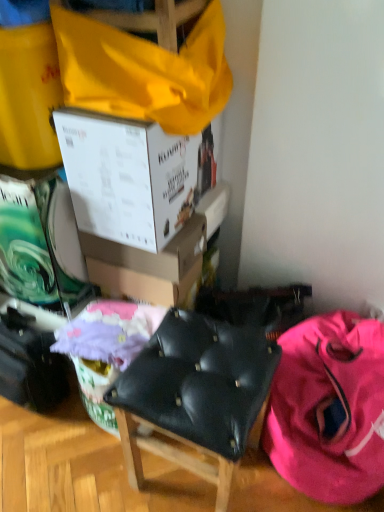
Measure the distance between white cardboard box at upper center, the 1th box positioned from the bottom, and camera.

white cardboard box at upper center, the 1th box positioned from the bottom, and camera are 1.20 meters apart from each other.

Locate an element on the screen. black leather chair at center is located at coordinates (196, 395).

The width and height of the screenshot is (384, 512). I want to click on pastel pink fabric at center, so click(x=109, y=332).

Image resolution: width=384 pixels, height=512 pixels. What are the coordinates of `white cardboard box at upper center, which ranks as the second box in bottom-to-top order` in the screenshot? It's located at (133, 177).

Consider the image. Between pastel pink fabric at center and pink fabric backpack at lower right, which one appears on the left side from the viewer's perspective?

pastel pink fabric at center is more to the left.

Is pastel pink fabric at center far away from pink fabric backpack at lower right?

No, pastel pink fabric at center is not far from pink fabric backpack at lower right.

Measure the distance from pastel pink fabric at center to pink fabric backpack at lower right.

pastel pink fabric at center is 21.01 inches from pink fabric backpack at lower right.

From a real-world perspective, which object rests below the other?

pink fabric backpack at lower right is physically lower.

Which of these two, white cardboard box at upper center, positioned as the 1th box in top-to-bottom order, or black leather chair at center, is wider?

Wider between the two is black leather chair at center.

Is white cardboard box at upper center, positioned as the 1th box in top-to-bottom order, touching black leather chair at center?

No, white cardboard box at upper center, positioned as the 1th box in top-to-bottom order, is not in contact with black leather chair at center.

Is white cardboard box at upper center, which ranks as the second box in bottom-to-top order, turned away from black leather chair at center?

No, white cardboard box at upper center, which ranks as the second box in bottom-to-top order,'s orientation is not away from black leather chair at center.

Who is taller, white cardboard box at upper center, positioned as the 1th box in top-to-bottom order, or black leather chair at center?

Standing taller between the two is black leather chair at center.

Are pastel pink fabric at center and white cardboard box at upper center, arranged as the second box when viewed from the top, beside each other?

No, pastel pink fabric at center is not touching white cardboard box at upper center, arranged as the second box when viewed from the top.

Is pastel pink fabric at center looking in the opposite direction of white cardboard box at upper center, the 1th box positioned from the bottom?

That's not correct — pastel pink fabric at center is not looking away from white cardboard box at upper center, the 1th box positioned from the bottom.

Can you confirm if pastel pink fabric at center is positioned to the right of white cardboard box at upper center, arranged as the second box when viewed from the top?

Incorrect, pastel pink fabric at center is not on the right side of white cardboard box at upper center, arranged as the second box when viewed from the top.

Which is behind, black leather chair at center or pastel pink fabric at center?

pastel pink fabric at center is behind.

Does black leather chair at center have a smaller size compared to pastel pink fabric at center?

Actually, black leather chair at center might be larger than pastel pink fabric at center.

How much distance is there between black leather chair at center and pastel pink fabric at center?

10.05 inches.

Which object is wider, white cardboard box at upper center, which ranks as the second box in bottom-to-top order, or pastel pink fabric at center?

white cardboard box at upper center, which ranks as the second box in bottom-to-top order.

From the image's perspective, between white cardboard box at upper center, positioned as the 1th box in top-to-bottom order, and pastel pink fabric at center, which one is located above?

From the image's view, white cardboard box at upper center, positioned as the 1th box in top-to-bottom order, is above.

Is white cardboard box at upper center, positioned as the 1th box in top-to-bottom order, looking in the opposite direction of pastel pink fabric at center?

white cardboard box at upper center, positioned as the 1th box in top-to-bottom order, is not turned away from pastel pink fabric at center.

Does white cardboard box at upper center, positioned as the 1th box in top-to-bottom order, appear on the right side of pastel pink fabric at center?

Yes, white cardboard box at upper center, positioned as the 1th box in top-to-bottom order, is to the right of pastel pink fabric at center.

Is pastel pink fabric at center looking in the opposite direction of white cardboard box at upper center, which ranks as the second box in bottom-to-top order?

No, pastel pink fabric at center is not facing away from white cardboard box at upper center, which ranks as the second box in bottom-to-top order.

Would you say white cardboard box at upper center, which ranks as the second box in bottom-to-top order, is part of pastel pink fabric at center's contents?

Actually, white cardboard box at upper center, which ranks as the second box in bottom-to-top order, is outside pastel pink fabric at center.

From the image's perspective, is pastel pink fabric at center positioned above or below white cardboard box at upper center, which ranks as the second box in bottom-to-top order?

From the image's perspective, pastel pink fabric at center appears below white cardboard box at upper center, which ranks as the second box in bottom-to-top order.

How distant is pastel pink fabric at center from white cardboard box at upper center, positioned as the 1th box in top-to-bottom order?

A distance of 14.68 inches exists between pastel pink fabric at center and white cardboard box at upper center, positioned as the 1th box in top-to-bottom order.

Which is behind, point (121, 267) or point (320, 351)?

The point (121, 267) is behind.

From the image's perspective, which is above, white cardboard box at upper center, the 1th box positioned from the bottom, or pink fabric backpack at lower right?

white cardboard box at upper center, the 1th box positioned from the bottom, appears higher in the image.

Between white cardboard box at upper center, arranged as the second box when viewed from the top, and pink fabric backpack at lower right, which one has smaller size?

white cardboard box at upper center, arranged as the second box when viewed from the top.

Locate an element on the screen. The height and width of the screenshot is (512, 384). clothing lying on the right of pastel pink fabric at center is located at coordinates (329, 408).

You are a GUI agent. You are given a task and a screenshot of the screen. Output one action in this format:
    pyautogui.click(x=<x>, y=<y>)
    Task: Click on the chair in front of the white cardboard box at upper center, which ranks as the second box in bottom-to-top order
    The height and width of the screenshot is (512, 384).
    Given the screenshot: What is the action you would take?
    pyautogui.click(x=196, y=395)

When comparing their distances from white cardboard box at upper center, which ranks as the second box in bottom-to-top order, does black leather chair at center or pastel pink fabric at center seem further?

black leather chair at center lies further to white cardboard box at upper center, which ranks as the second box in bottom-to-top order, than the other object.

From the image, which object appears to be farther from white cardboard box at upper center, arranged as the second box when viewed from the top, pink fabric backpack at lower right or white cardboard box at upper center, positioned as the 1th box in top-to-bottom order?

pink fabric backpack at lower right is positioned further to the anchor white cardboard box at upper center, arranged as the second box when viewed from the top.

Estimate the real-world distances between objects in this image. Which object is further from white cardboard box at upper center, arranged as the second box when viewed from the top, white cardboard box at upper center, which ranks as the second box in bottom-to-top order, or pastel pink fabric at center?

pastel pink fabric at center is further to white cardboard box at upper center, arranged as the second box when viewed from the top.

Which object lies nearer to the anchor point white cardboard box at upper center, the 1th box positioned from the bottom, pastel pink fabric at center or black leather chair at center?

pastel pink fabric at center.

Based on their spatial positions, is white cardboard box at upper center, arranged as the second box when viewed from the top, or black leather chair at center closer to pink fabric backpack at lower right?

black leather chair at center is closer to pink fabric backpack at lower right.

Looking at the image, which one is located further to white cardboard box at upper center, arranged as the second box when viewed from the top, black leather chair at center or pink fabric backpack at lower right?

pink fabric backpack at lower right.

Looking at the image, which one is located further to white cardboard box at upper center, positioned as the 1th box in top-to-bottom order, white cardboard box at upper center, arranged as the second box when viewed from the top, or black leather chair at center?

black leather chair at center is further to white cardboard box at upper center, positioned as the 1th box in top-to-bottom order.

Considering their positions, is black leather chair at center positioned closer to pink fabric backpack at lower right than white cardboard box at upper center, positioned as the 1th box in top-to-bottom order?

Based on the image, black leather chair at center appears to be nearer to pink fabric backpack at lower right.

Locate an element on the screen. blanket that lies between white cardboard box at upper center, arranged as the second box when viewed from the top, and black leather chair at center from top to bottom is located at coordinates (109, 332).

Image resolution: width=384 pixels, height=512 pixels. In order to click on chair between white cardboard box at upper center, the 1th box positioned from the bottom, and pink fabric backpack at lower right from left to right in this screenshot , I will do `click(196, 395)`.

At what (x,y) coordinates should I click in order to perform the action: click on box between white cardboard box at upper center, which ranks as the second box in bottom-to-top order, and pastel pink fabric at center in the up-down direction. Please return your answer as a coordinate pair (x, y). The height and width of the screenshot is (512, 384). Looking at the image, I should click on (148, 254).

I want to click on blanket between white cardboard box at upper center, which ranks as the second box in bottom-to-top order, and black leather chair at center vertically, so click(x=109, y=332).